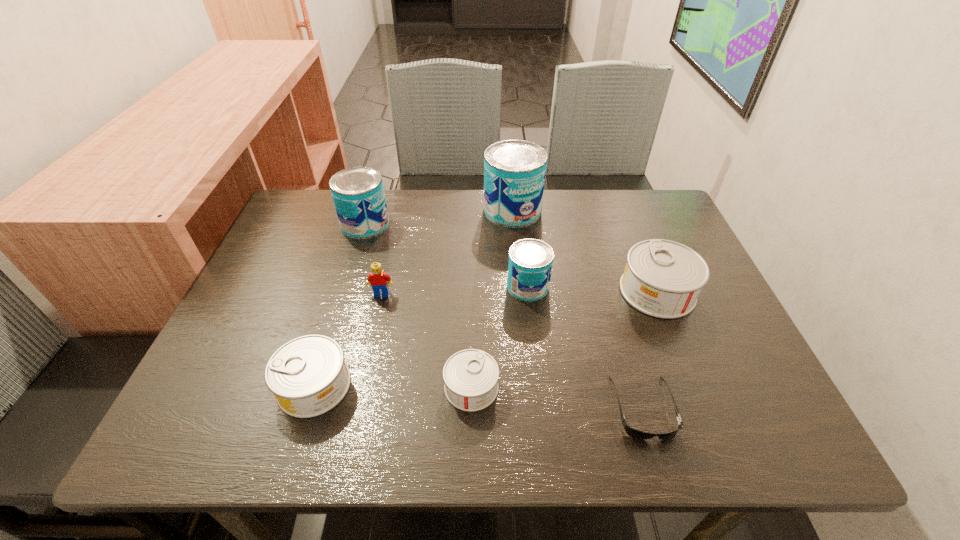
Where is `the shortest can`? The image size is (960, 540). the shortest can is located at coordinates (470, 376).

Locate an element on the screen. This screenshot has height=540, width=960. the smallest silver can is located at coordinates (470, 376).

This screenshot has height=540, width=960. I want to click on sunglasses, so click(x=633, y=433).

You are a GUI agent. You are given a task and a screenshot of the screen. Output one action in this format:
    pyautogui.click(x=<x>, y=<y>)
    Task: Click on the free location located 0.360m on the right of the biggest blue can
    
    Given the screenshot: What is the action you would take?
    pyautogui.click(x=663, y=210)

Locate an element on the screen. The width and height of the screenshot is (960, 540). free point located on the right of the fifth shortest can is located at coordinates (488, 224).

Where is `vacant space located on the back of the smallest blue can`? This screenshot has height=540, width=960. vacant space located on the back of the smallest blue can is located at coordinates [523, 246].

You are a GUI agent. You are given a task and a screenshot of the screen. Output one action in this format:
    pyautogui.click(x=<x>, y=<y>)
    Task: Click on the vacant region located on the face of the red Lego
    
    Given the screenshot: What is the action you would take?
    pyautogui.click(x=368, y=356)

This screenshot has height=540, width=960. In order to click on vacant space located 0.170m on the left of the rightmost can in this screenshot , I will do `click(549, 291)`.

You are a GUI agent. You are given a task and a screenshot of the screen. Output one action in this format:
    pyautogui.click(x=<x>, y=<y>)
    Task: Click on the free region located on the back of the leftmost silver can
    The height and width of the screenshot is (540, 960).
    Given the screenshot: What is the action you would take?
    pyautogui.click(x=335, y=319)

You are a GUI agent. You are given a task and a screenshot of the screen. Output one action in this format:
    pyautogui.click(x=<x>, y=<y>)
    Task: Click on the free spot located 0.220m on the back of the second silver can from left to right
    
    Given the screenshot: What is the action you would take?
    pyautogui.click(x=473, y=289)